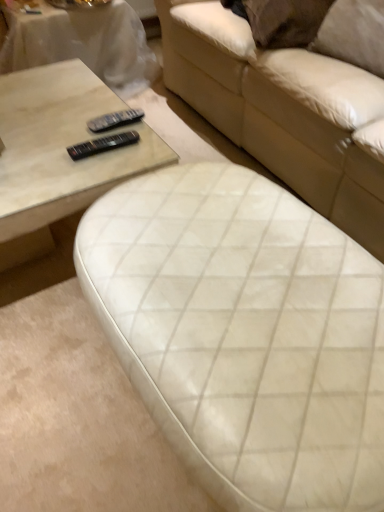
Locate an element on the screen. The width and height of the screenshot is (384, 512). free space in front of black plastic remote at upper center, which is the second remote in bottom-to-top order is located at coordinates (98, 164).